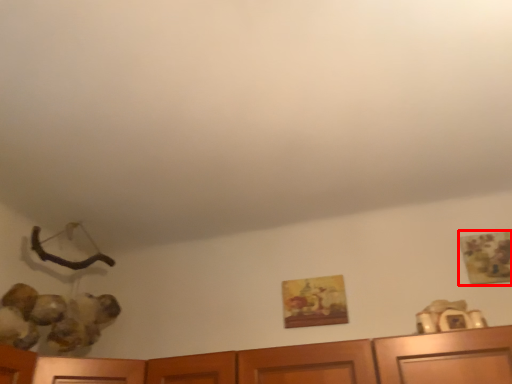
Question: From the image's perspective, where is picture frame (annotated by the red box) located relative to picture frame?

Choices:
 (A) above
 (B) below

Answer: (A)